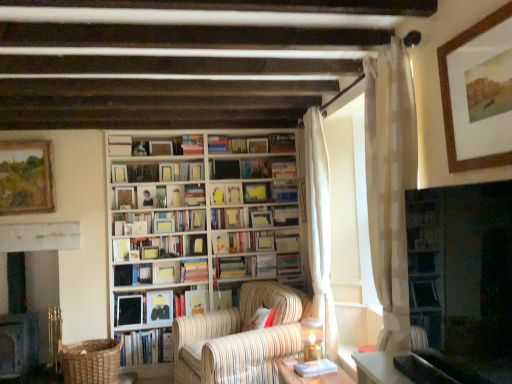
Question: Is hardcover book at center, which is the sixth book in bottom-to-top order, wider than matte black book at center, marked as the fourteenth book in a top-to-bottom arrangement?

Choices:
 (A) yes
 (B) no

Answer: (A)

Question: Is hardcover book at center, which is the sixth book in bottom-to-top order, to the left of matte black book at center, which is the fourth book from bottom to top, from the viewer's perspective?

Choices:
 (A) yes
 (B) no

Answer: (B)

Question: Is hardcover book at center, which is the sixth book in bottom-to-top order, positioned beyond the bounds of matte black book at center, which is the fourth book from bottom to top?

Choices:
 (A) yes
 (B) no

Answer: (A)

Question: Is hardcover book at center, which is the sixth book in bottom-to-top order, to the right of matte black book at center, marked as the fourteenth book in a top-to-bottom arrangement, from the viewer's perspective?

Choices:
 (A) yes
 (B) no

Answer: (A)

Question: Can you confirm if hardcover book at center, positioned as the 12th book in top-to-bottom order, is taller than matte black book at center, marked as the fourteenth book in a top-to-bottom arrangement?

Choices:
 (A) no
 (B) yes

Answer: (A)

Question: Is hardcover book at center, which is the sixth book in bottom-to-top order, positioned far away from matte black book at center, which is the fourth book from bottom to top?

Choices:
 (A) no
 (B) yes

Answer: (A)

Question: Is hardcover book at center, which is the 15th book from bottom to top, positioned far away from dark gray stone fireplace at left?

Choices:
 (A) no
 (B) yes

Answer: (B)

Question: Could you tell me if hardcover book at center, marked as the third book in a top-to-bottom arrangement, is facing dark gray stone fireplace at left?

Choices:
 (A) yes
 (B) no

Answer: (B)

Question: Considering the relative positions of hardcover book at center, which is the 15th book from bottom to top, and dark gray stone fireplace at left in the image provided, is hardcover book at center, which is the 15th book from bottom to top, to the left of dark gray stone fireplace at left from the viewer's perspective?

Choices:
 (A) no
 (B) yes

Answer: (A)

Question: Is the position of hardcover book at center, marked as the third book in a top-to-bottom arrangement, more distant than that of dark gray stone fireplace at left?

Choices:
 (A) no
 (B) yes

Answer: (B)

Question: From a real-world perspective, does hardcover book at center, which is the 15th book from bottom to top, sit lower than dark gray stone fireplace at left?

Choices:
 (A) yes
 (B) no

Answer: (B)

Question: Does hardcover book at center, which is the 15th book from bottom to top, contain dark gray stone fireplace at left?

Choices:
 (A) yes
 (B) no

Answer: (B)

Question: Could you tell me if hardcover book at center, the 12th book when ordered from bottom to top, is turned towards hardcover books at center, acting as the seventh book starting from the bottom?

Choices:
 (A) yes
 (B) no

Answer: (B)